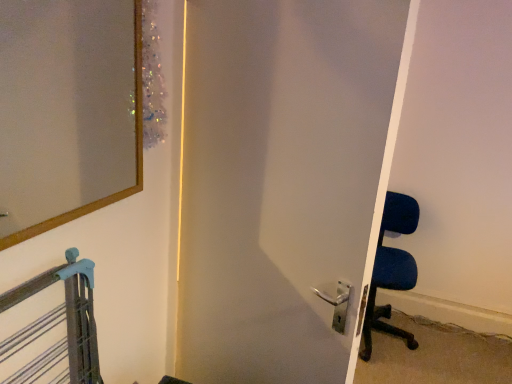
Question: In terms of size, does satin white door at center appear bigger or smaller than wooden-framed mirror at upper left?

Choices:
 (A) big
 (B) small

Answer: (A)

Question: Is satin white door at center to the left or to the right of wooden-framed mirror at upper left in the image?

Choices:
 (A) right
 (B) left

Answer: (A)

Question: Which object is positioned closest to the wooden-framed mirror at upper left?

Choices:
 (A) blue fabric chair at right
 (B) satin white door at center

Answer: (B)

Question: Which object is positioned farthest from the wooden-framed mirror at upper left?

Choices:
 (A) satin white door at center
 (B) blue fabric chair at right

Answer: (B)